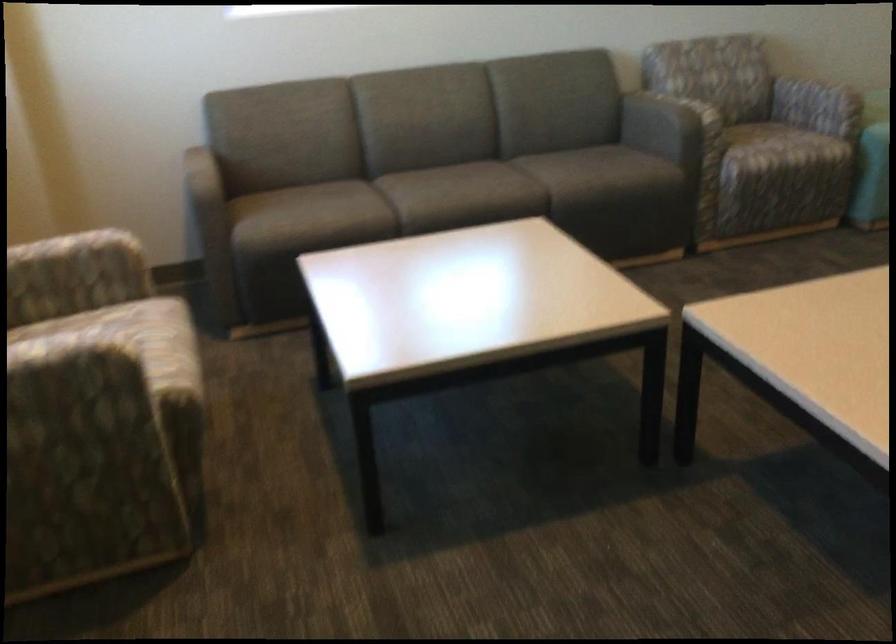
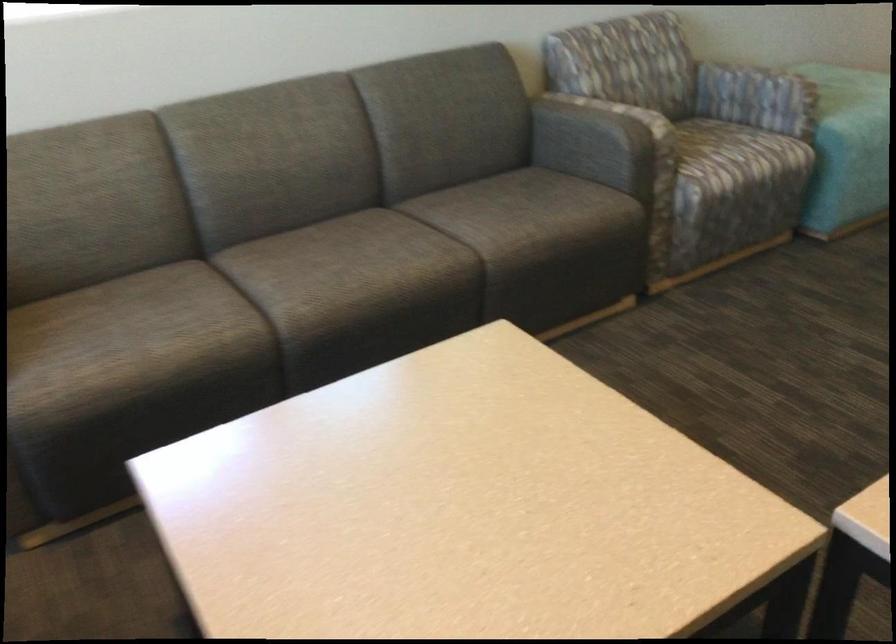
Question: Which direction would the cameraman need to move to produce the second image? Reply with the corresponding letter.

Choices:
 (A) Left
 (B) Right
 (C) Forward
 (D) Backward

Answer: (C)